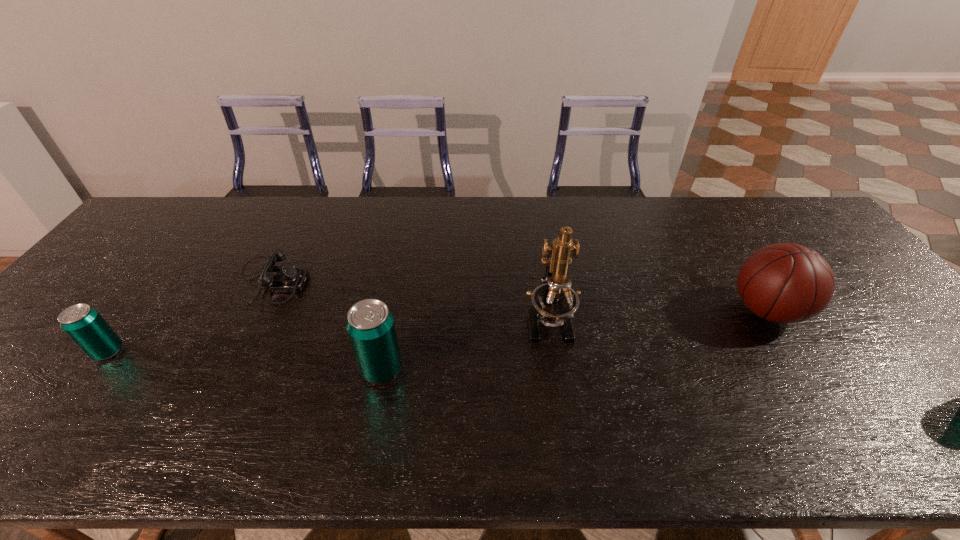
Image resolution: width=960 pixels, height=540 pixels. What are the coordinates of `vacant region that satisfies the following two spatial constraints: 1. on the front side of the right beer can; 2. on the right side of the fourth tallest object` in the screenshot? It's located at (95, 369).

This screenshot has width=960, height=540. Find the location of `free space that satisfies the following two spatial constraints: 1. on the front-facing side of the third object from left to right; 2. on the left side of the shortest object`. free space that satisfies the following two spatial constraints: 1. on the front-facing side of the third object from left to right; 2. on the left side of the shortest object is located at coordinates (228, 369).

Locate an element on the screen. The height and width of the screenshot is (540, 960). blank space that satisfies the following two spatial constraints: 1. on the front-facing side of the telephone; 2. on the left side of the third object from left to right is located at coordinates (228, 369).